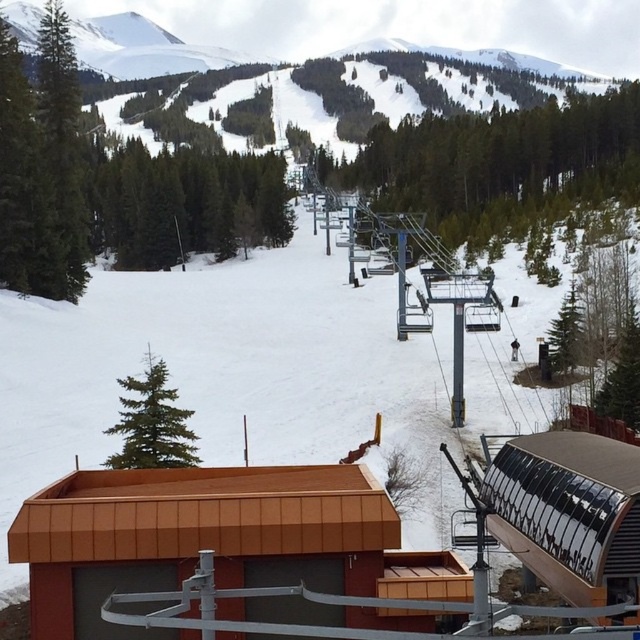
Between green matte pine at upper left and black fabric skier at center-right, which one has more height?

Standing taller between the two is green matte pine at upper left.

Who is lower down, green matte pine at upper left or black fabric skier at center-right?

green matte pine at upper left is below.

This screenshot has width=640, height=640. In order to click on green matte pine at upper left in this screenshot , I will do `click(150, 422)`.

Is brown corrugated metal ski resort at center bigger than green matte pine at upper left?

Actually, brown corrugated metal ski resort at center might be smaller than green matte pine at upper left.

Does brown corrugated metal ski resort at center lie behind green matte pine at upper left?

No, it is in front of green matte pine at upper left.

Does point (221, 525) come in front of point (125, 403)?

Yes, it is.

I want to click on brown corrugated metal ski resort at center, so click(x=212, y=540).

Is brown corrugated metal ski resort at center above black fabric skier at center-right?

No.

Can you confirm if brown corrugated metal ski resort at center is wider than black fabric skier at center-right?

Yes.

Is point (147, 584) more distant than point (513, 358)?

No, it is in front of (513, 358).

Where is `brown corrugated metal ski resort at center`? The height and width of the screenshot is (640, 640). brown corrugated metal ski resort at center is located at coordinates (212, 540).